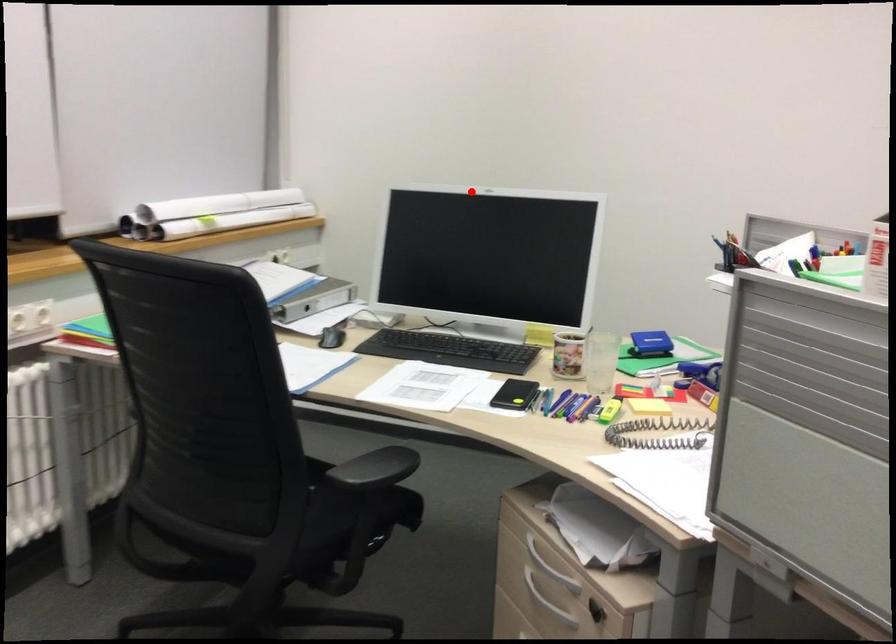
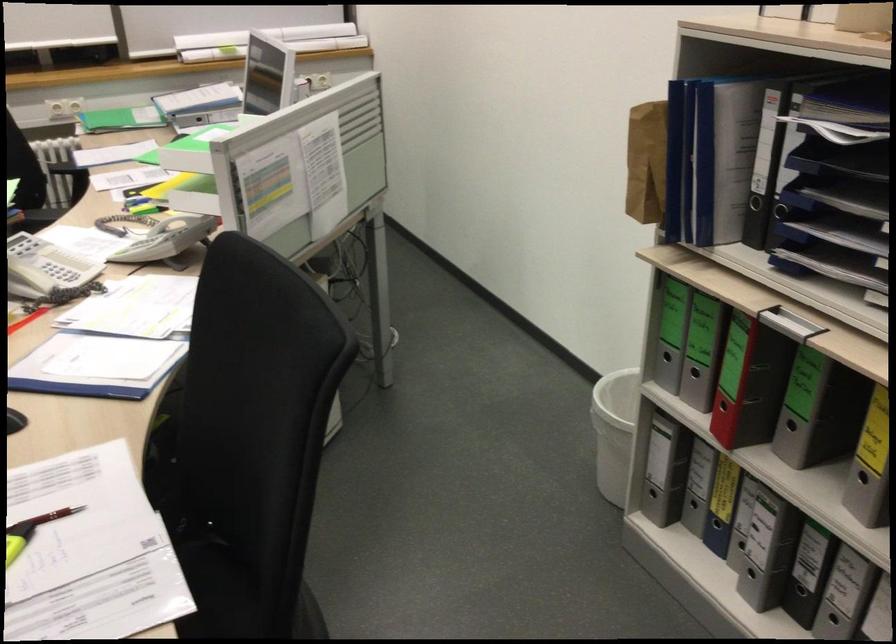
Find the pixel in the second image that matches the highlighted location in the first image.

(268, 41)